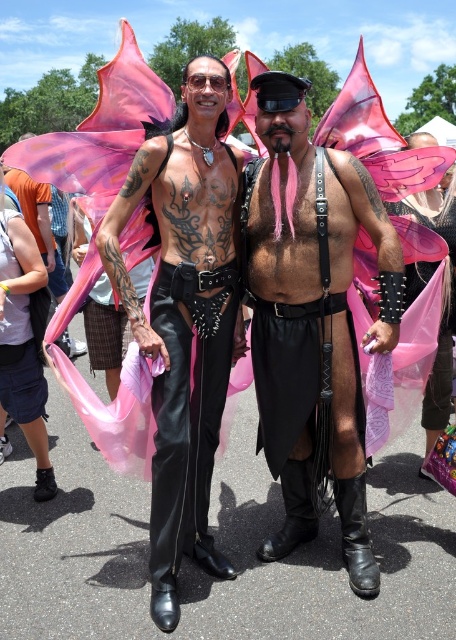
You are a costume designer observing the two individuals in the image. You need to determine which piece of clothing is more prominent in height between the matte black leather vest at center and the matte black leather pants at center. Which one is taller?

The matte black leather vest at center is much taller as matte black leather pants at center, so the vest is taller.